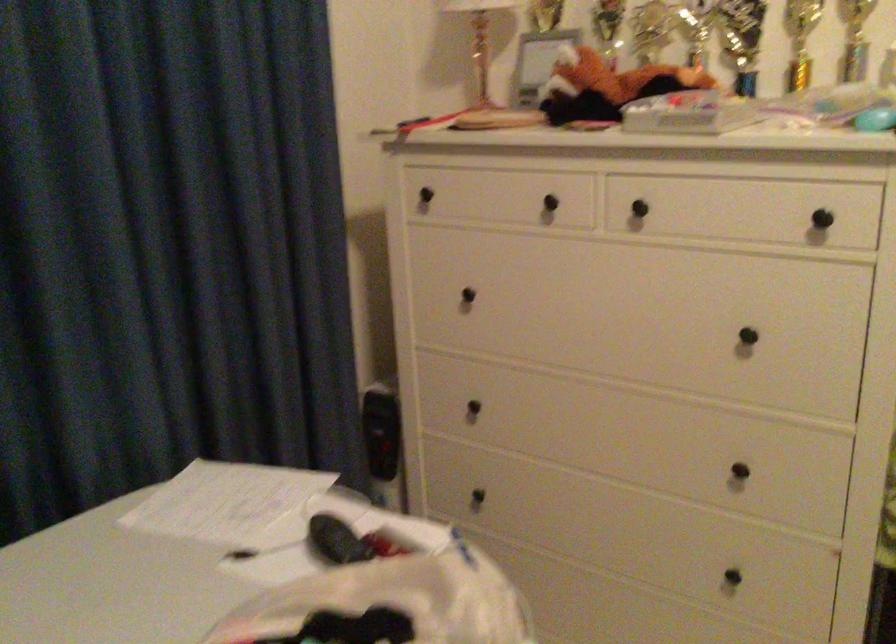
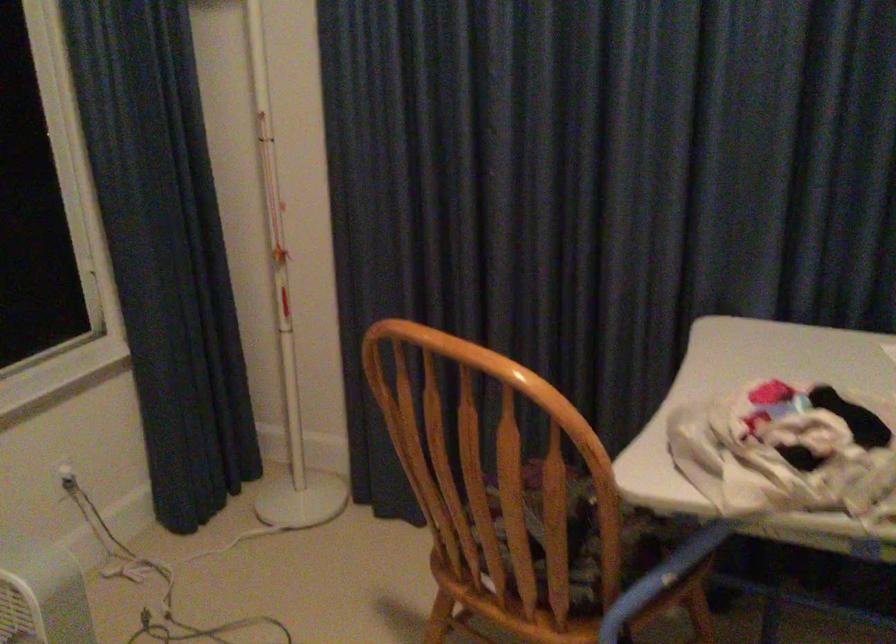
How did the camera likely rotate?

The rotation direction of the camera is left-down.